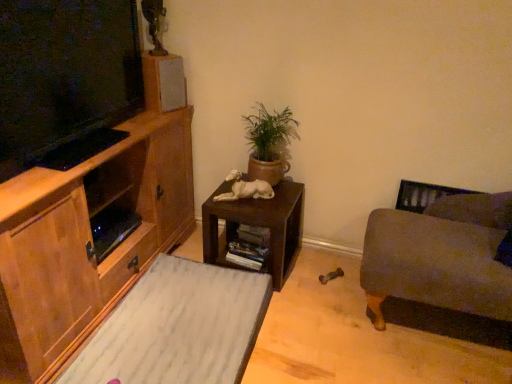
Image resolution: width=512 pixels, height=384 pixels. I want to click on vacant region in front of green terracotta pot at center, so click(264, 206).